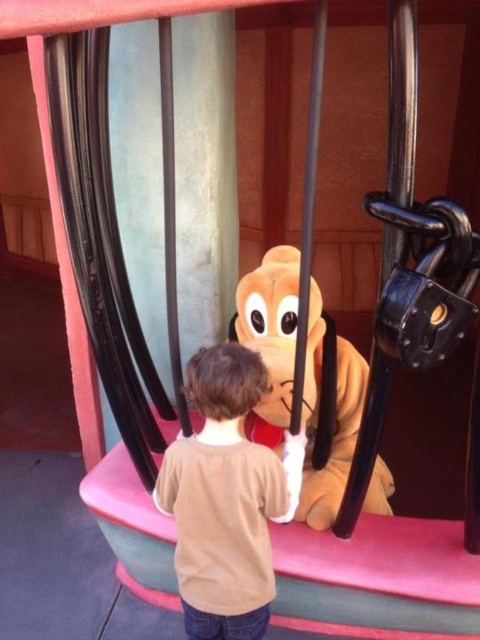
Question: Which of the following is the closest to the observer?

Choices:
 (A) (316, 516)
 (B) (189, 620)

Answer: (B)

Question: Does brown cotton shirt at center appear on the left side of fuzzy yellow dog at center?

Choices:
 (A) yes
 (B) no

Answer: (A)

Question: Among these objects, which one is farthest from the camera?

Choices:
 (A) fuzzy yellow dog at center
 (B) brown cotton shirt at center

Answer: (A)

Question: Observing the image, what is the correct spatial positioning of brown cotton shirt at center in reference to fuzzy yellow dog at center?

Choices:
 (A) right
 (B) left

Answer: (B)

Question: Does brown cotton shirt at center appear on the right side of fuzzy yellow dog at center?

Choices:
 (A) yes
 (B) no

Answer: (B)